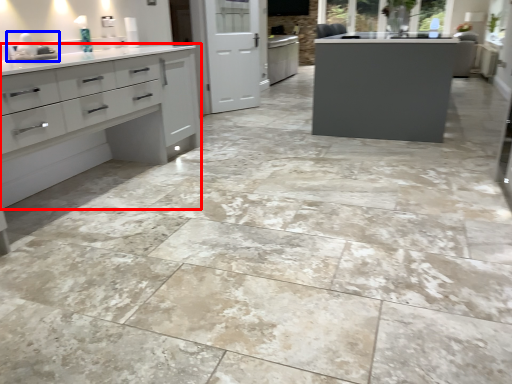
Question: Which object is closer to the camera taking this photo, cupboard (highlighted by a red box) or sink (highlighted by a blue box)?

Choices:
 (A) cupboard
 (B) sink

Answer: (A)